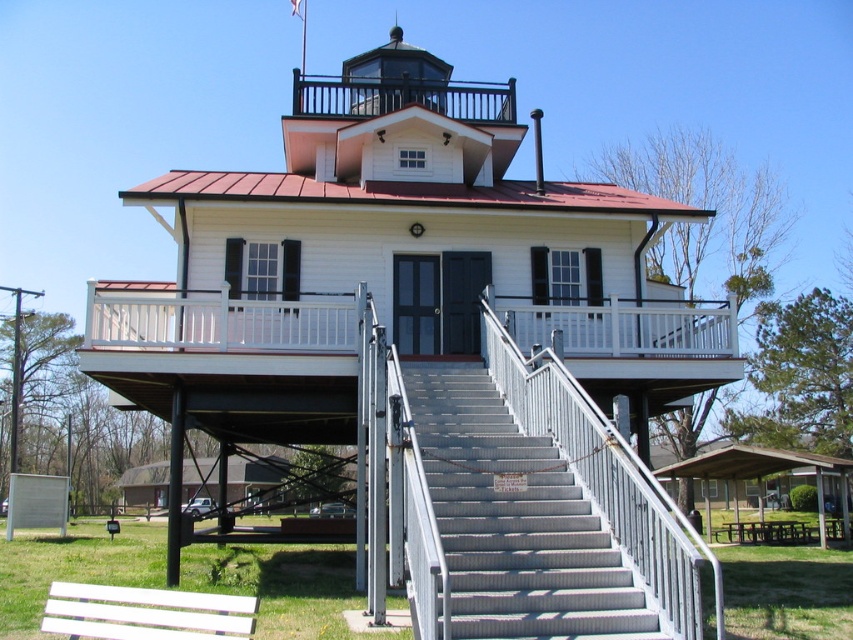
Identify the location of metallic gray stairs at center. The width and height of the screenshot is (853, 640). (514, 520).

Is point (444, 388) closer to viewer compared to point (189, 596)?

No, (444, 388) is further to viewer.

Describe the element at coordinates (514, 520) in the screenshot. I see `metallic gray stairs at center` at that location.

I want to click on metallic gray stairs at center, so click(x=514, y=520).